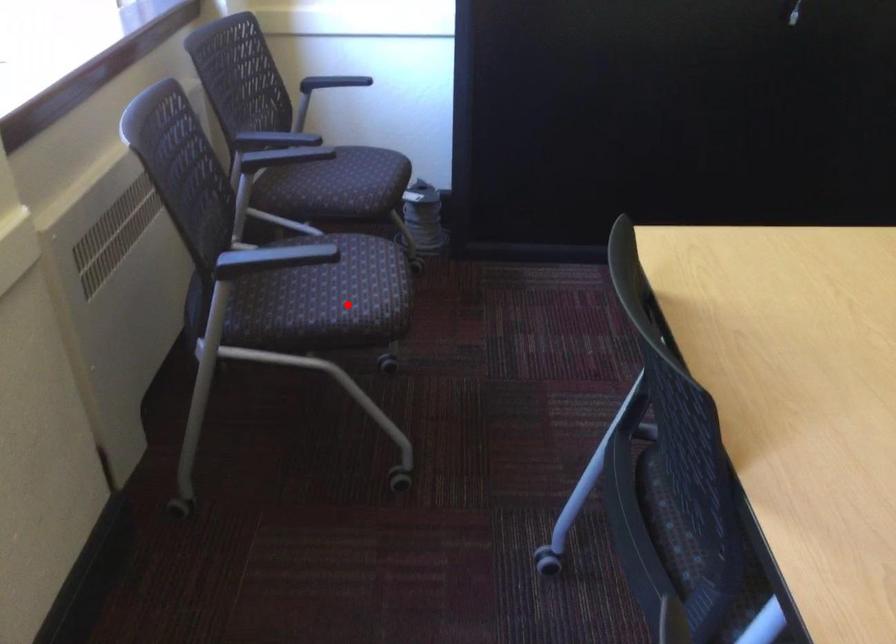
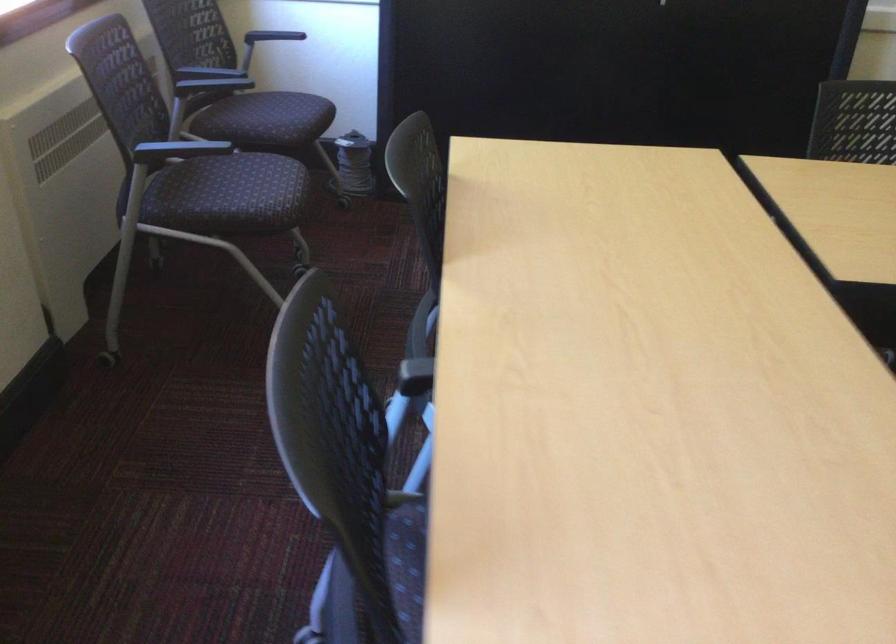
Locate, in the second image, the point that corresponds to the highlighted location in the first image.

(250, 198)